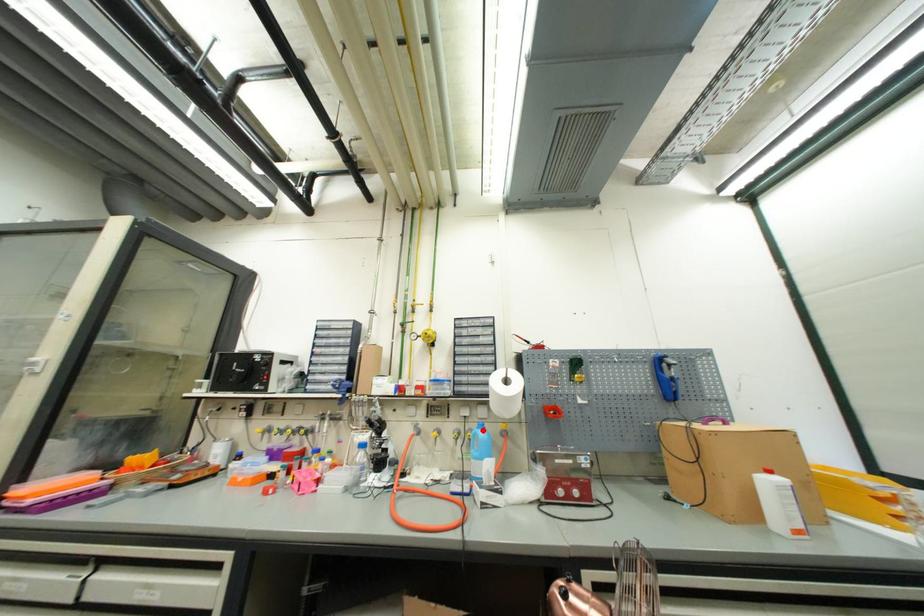
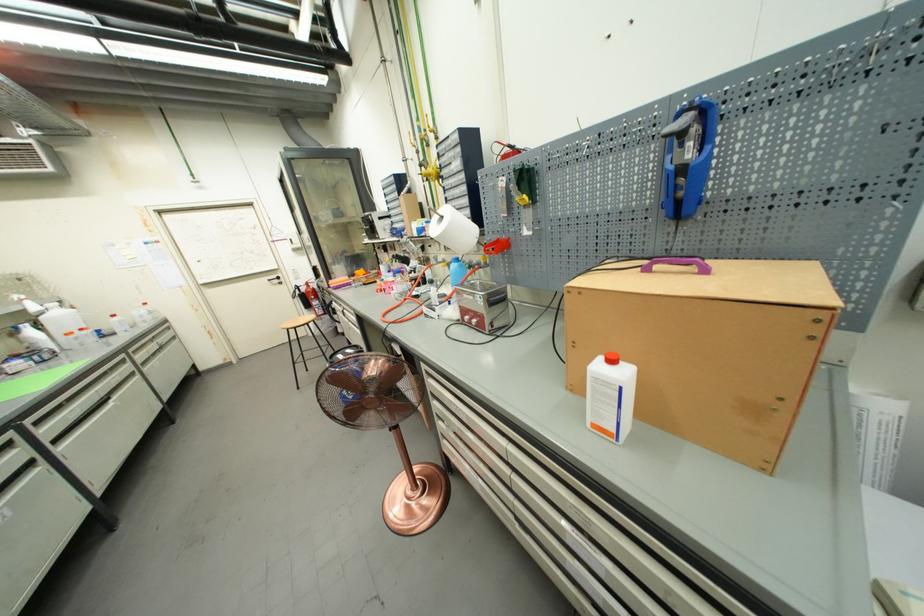
Question: A red point is marked in image1. In image2, is the corresponding 3D point closer to the camera or farther? Reply with the corresponding letter.

Choices:
 (A) The corresponding 3D point is closer.
 (B) The corresponding 3D point is farther.

Answer: (A)